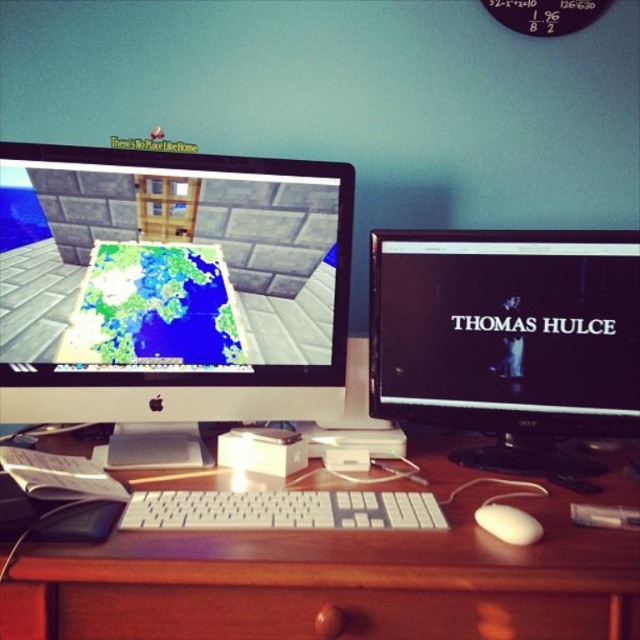
Question: Which point is closer to the camera taking this photo?

Choices:
 (A) (168, 621)
 (B) (150, 529)
 (C) (170, 252)
 (D) (518, 637)

Answer: (A)

Question: Does black glossy monitor at center lie in front of white matte mouse at lower right?

Choices:
 (A) yes
 (B) no

Answer: (B)

Question: Which point is closer to the camera?

Choices:
 (A) black glossy monitor at center
 (B) white matte mouse at lower right
 (C) wooden desk at center

Answer: (C)

Question: In this image, where is matte black monitor at center located relative to black glossy monitor at center?

Choices:
 (A) left
 (B) right

Answer: (A)

Question: Can you confirm if black glossy monitor at center is positioned below white plastic keyboard at center?

Choices:
 (A) yes
 (B) no

Answer: (B)

Question: Which object appears farthest from the camera in this image?

Choices:
 (A) wooden at center
 (B) black glossy monitor at center

Answer: (B)